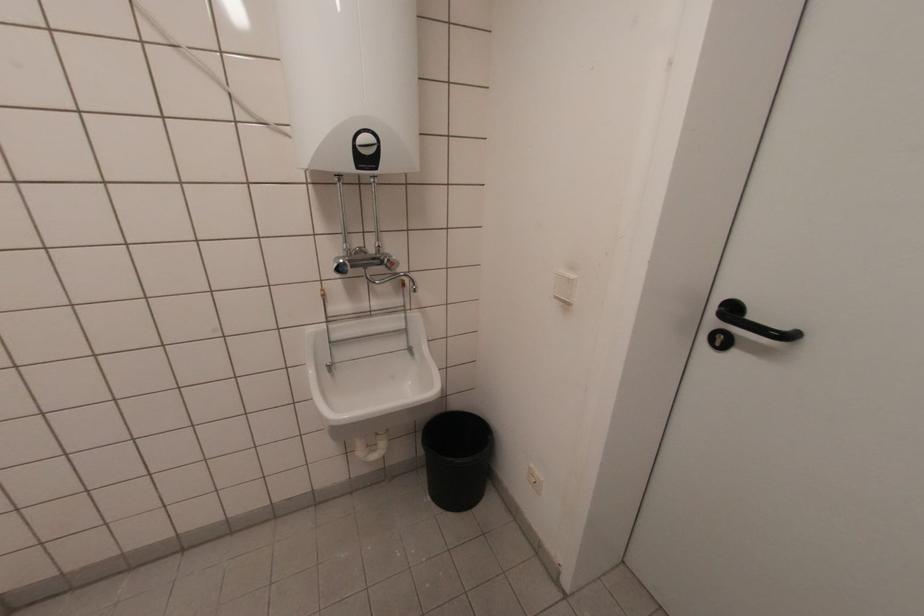
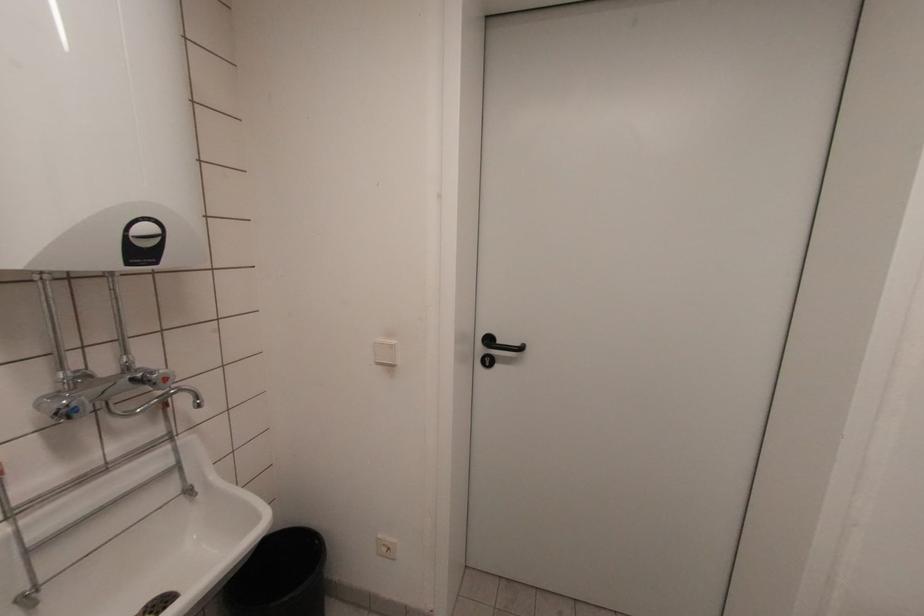
Question: The camera is either moving clockwise (left) or counter-clockwise (right) around the object. The first image is from the beginning of the video and the second image is from the end. Is the camera moving left or right when shooting the video?

Choices:
 (A) Left
 (B) Right

Answer: (A)